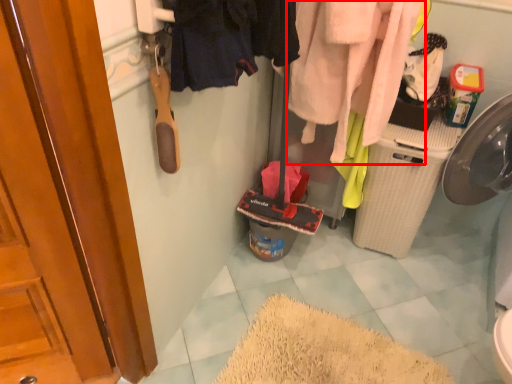
Question: Considering the relative positions of clothing (annotated by the red box) and clothing in the image provided, where is clothing (annotated by the red box) located with respect to the staircase?

Choices:
 (A) left
 (B) right

Answer: (B)